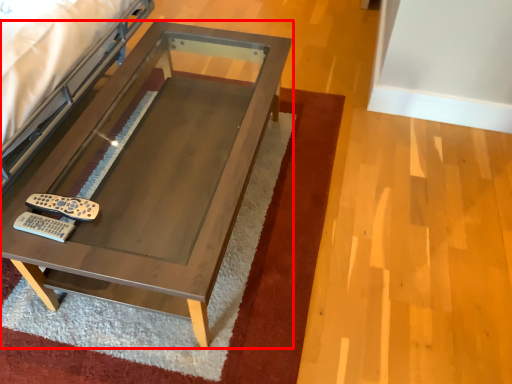
Question: Considering the relative positions of table (annotated by the red box) and remote in the image provided, where is table (annotated by the red box) located with respect to the staircase?

Choices:
 (A) left
 (B) right

Answer: (B)